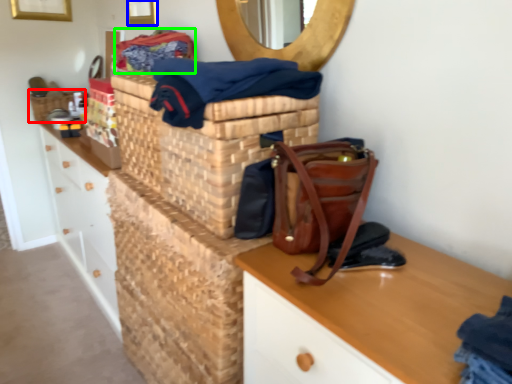
Question: Which is farther away from basket (highlighted by a red box)? picture frame (highlighted by a blue box) or material (highlighted by a green box)?

Choices:
 (A) picture frame
 (B) material

Answer: (B)